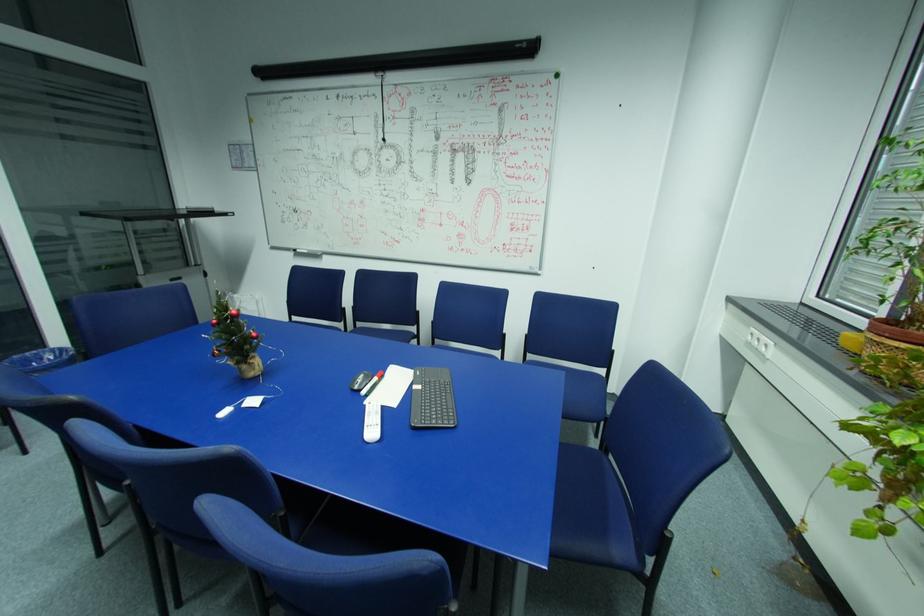
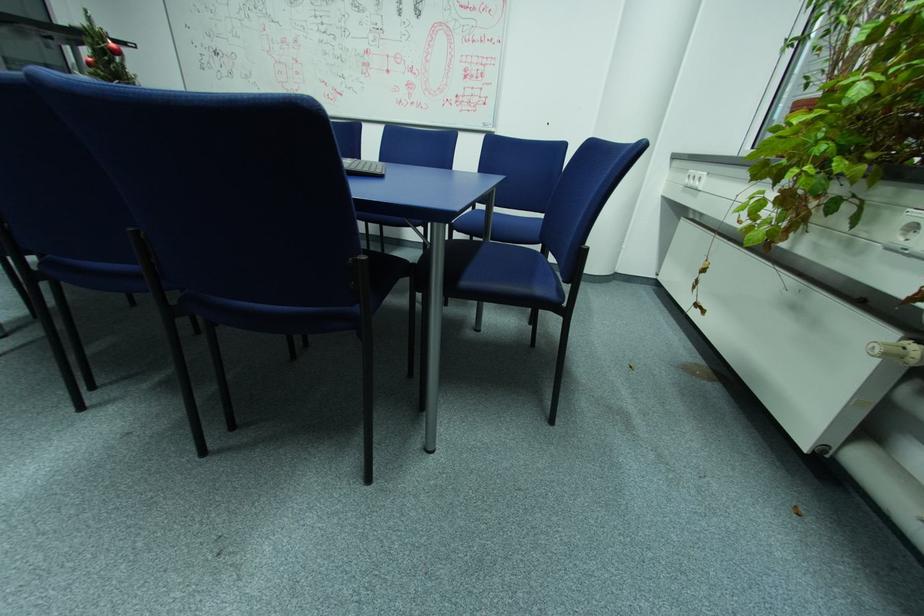
Question: Which direction would the cameraman need to move to produce the second image? Reply with the corresponding letter.

Choices:
 (A) Left
 (B) Right
 (C) Forward
 (D) Backward

Answer: (B)